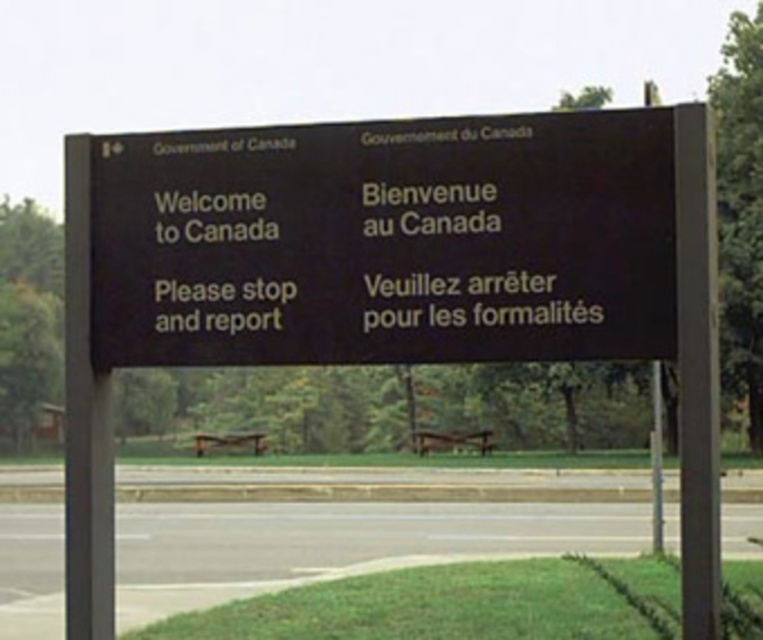
You are driving towards the border and see the black matte signboard at center and the black matte sign at center. Which one is taller?

The black matte signboard at center is taller than the black matte sign at center.

You are driving towards the signboard and see two points marked on the road ahead. The first point is at coordinates point (169, 268) and the second point is at point (588, 259). Which point is closer to your vehicle as you approach the signboard?

Point (169, 268) is closer to your vehicle because it is further to the viewer than point (588, 259), meaning it is nearer to your current position.

You are a driver approaching the border crossing and see the black matte signboard at center and the black matte sign at center. Which one is closer to you?

Both the black matte signboard at center and the black matte sign at center are the same object, so there is no difference in distance.